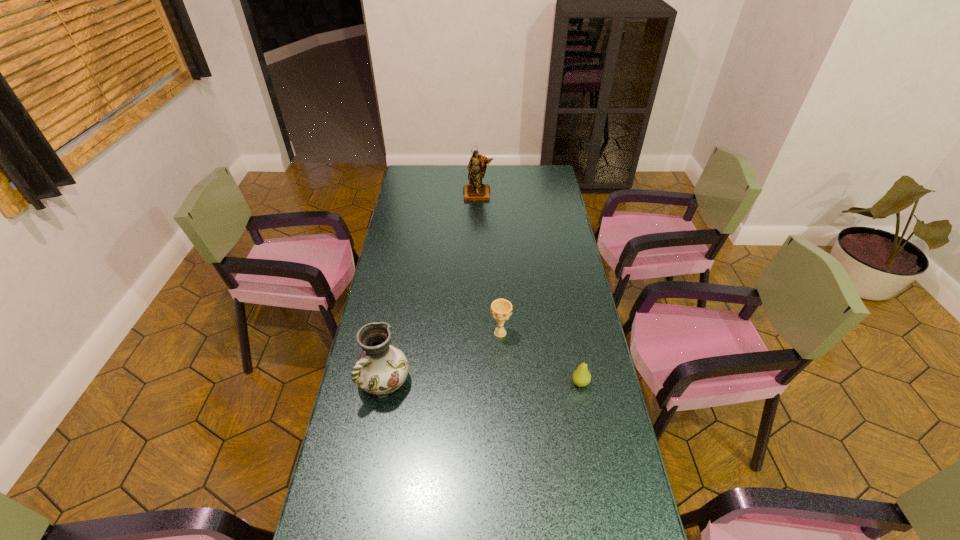
Identify the location of object present at the far edge. The height and width of the screenshot is (540, 960). (475, 190).

Identify the location of object situated at the left edge. point(381,369).

Find the location of a particular element. object that is positioned at the right edge is located at coordinates (581, 377).

This screenshot has height=540, width=960. I want to click on free point at the far edge, so click(x=526, y=178).

You are a GUI agent. You are given a task and a screenshot of the screen. Output one action in this format:
    pyautogui.click(x=<x>, y=<y>)
    Task: Click on the free space at the left edge
    This screenshot has height=540, width=960.
    Given the screenshot: What is the action you would take?
    pyautogui.click(x=336, y=504)

Find the location of a particular element. The width and height of the screenshot is (960, 540). vacant space at the right edge of the desktop is located at coordinates (535, 226).

You are a GUI agent. You are given a task and a screenshot of the screen. Output one action in this format:
    pyautogui.click(x=<x>, y=<y>)
    Task: Click on the free space between the pear and the vase
    The image size is (960, 540).
    Given the screenshot: What is the action you would take?
    pyautogui.click(x=483, y=382)

The image size is (960, 540). I want to click on vacant region between the farthest object and the leftmost object, so click(431, 288).

You are a GUI agent. You are given a task and a screenshot of the screen. Output one action in this format:
    pyautogui.click(x=<x>, y=<y>)
    Task: Click on the free space between the leftmost object and the figurine
    Image resolution: width=960 pixels, height=540 pixels.
    Given the screenshot: What is the action you would take?
    pyautogui.click(x=431, y=288)

Find the location of `vacant space in between the figurine and the chalice`. vacant space in between the figurine and the chalice is located at coordinates (490, 264).